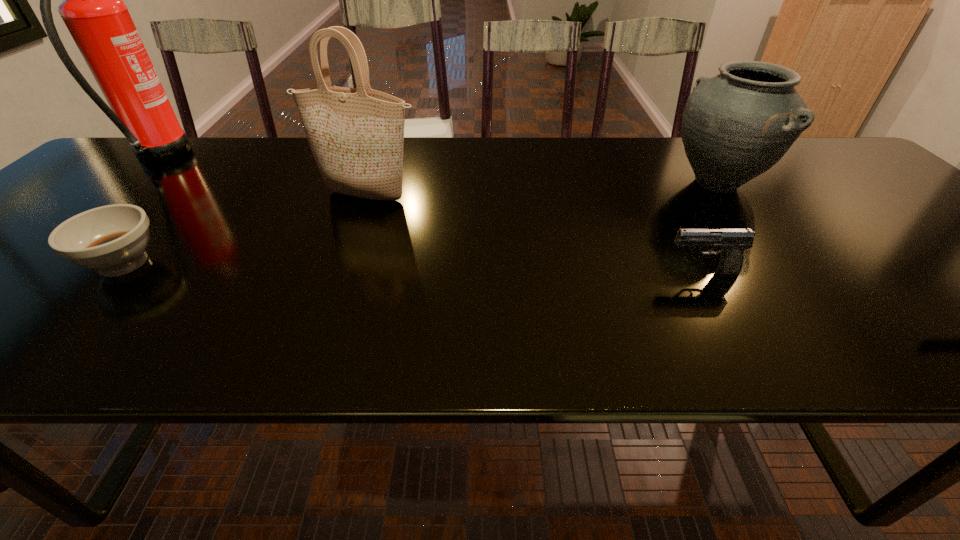
I want to click on free point that satisfies the following two spatial constraints: 1. at the nozzle of the fire extinguisher; 2. on the back side of the shopping bag, so click(113, 197).

Find the location of a particular element. This screenshot has width=960, height=540. vacant space that satisfies the following two spatial constraints: 1. at the nozzle of the leftmost object; 2. on the right side of the second object from left to right is located at coordinates (36, 263).

Where is `free spot that satisfies the following two spatial constraints: 1. at the nozzle of the third shortest object; 2. on the left side of the tallest object`? The width and height of the screenshot is (960, 540). free spot that satisfies the following two spatial constraints: 1. at the nozzle of the third shortest object; 2. on the left side of the tallest object is located at coordinates (129, 183).